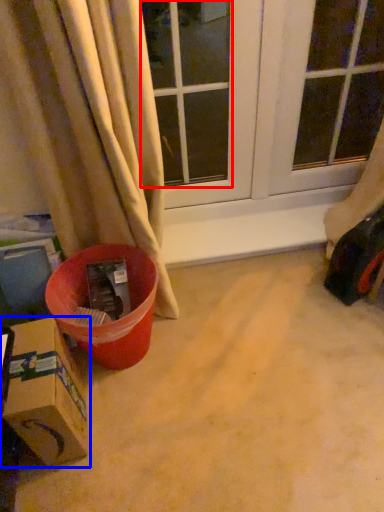
Question: Which of the following is the farthest to the observer, window (highlighted by a red box) or box (highlighted by a blue box)?

Choices:
 (A) window
 (B) box

Answer: (A)